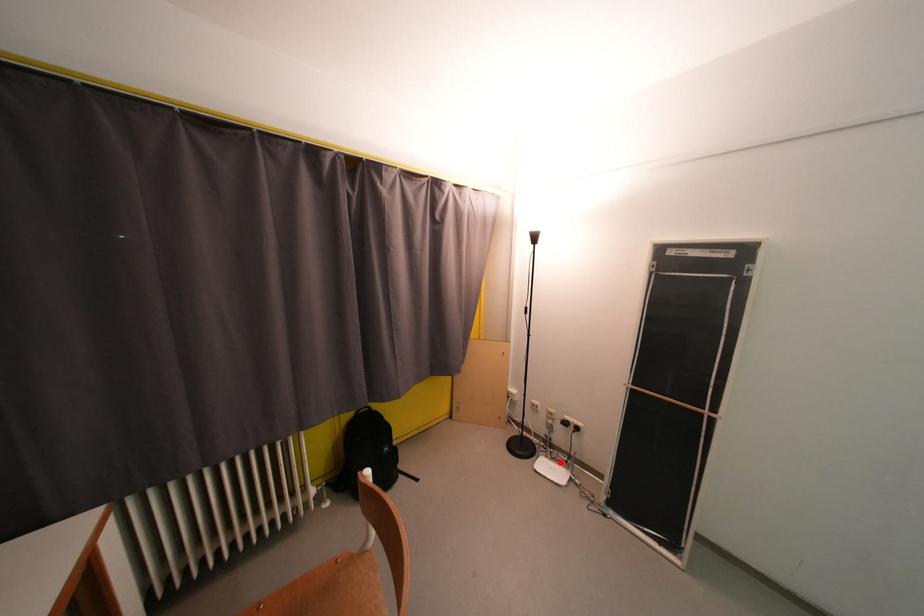
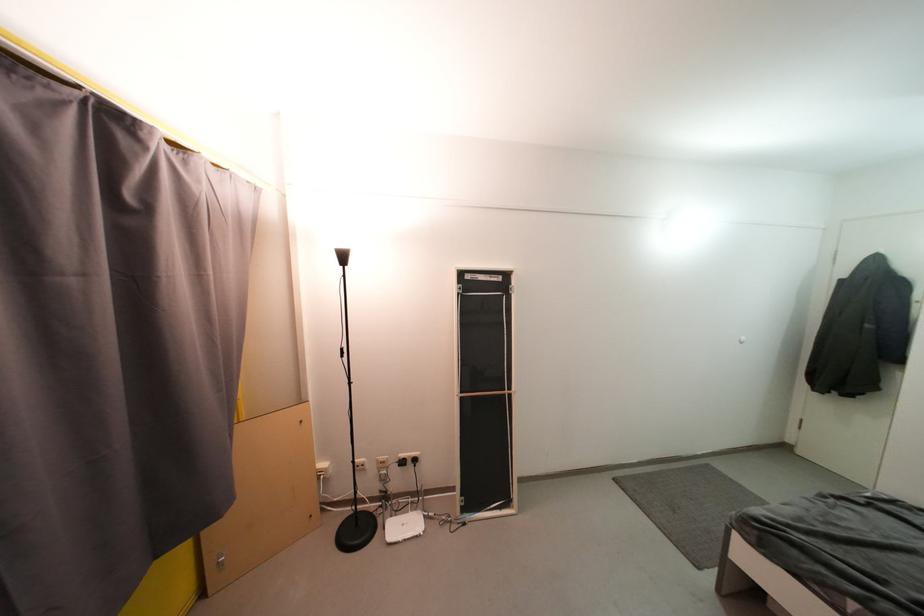
Locate, in the second image, the point that corresponds to the highlighted location in the first image.

(405, 515)